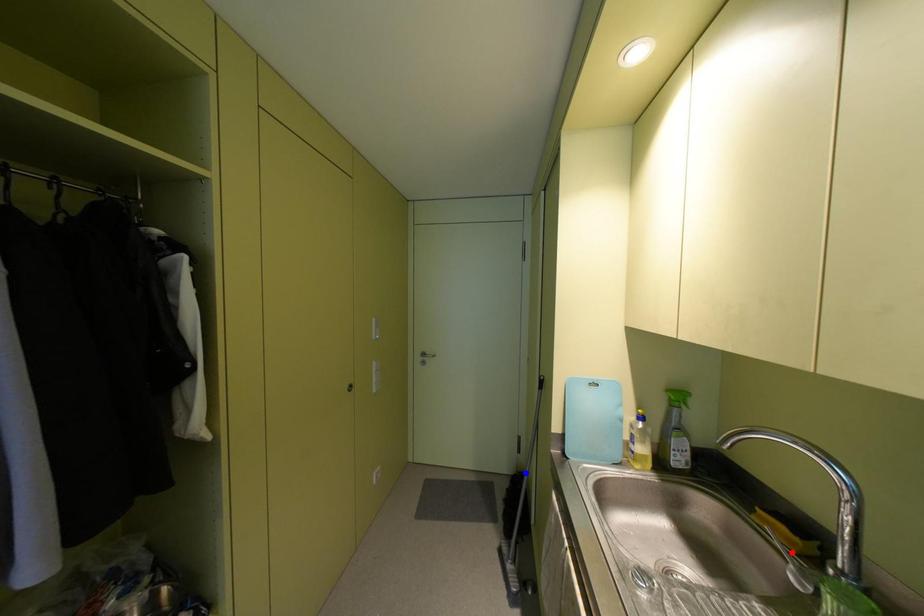
Question: In the image, two points are highlighted. Which point is nearer to the camera? Reply with the corresponding letter.

Choices:
 (A) blue point
 (B) red point

Answer: (B)